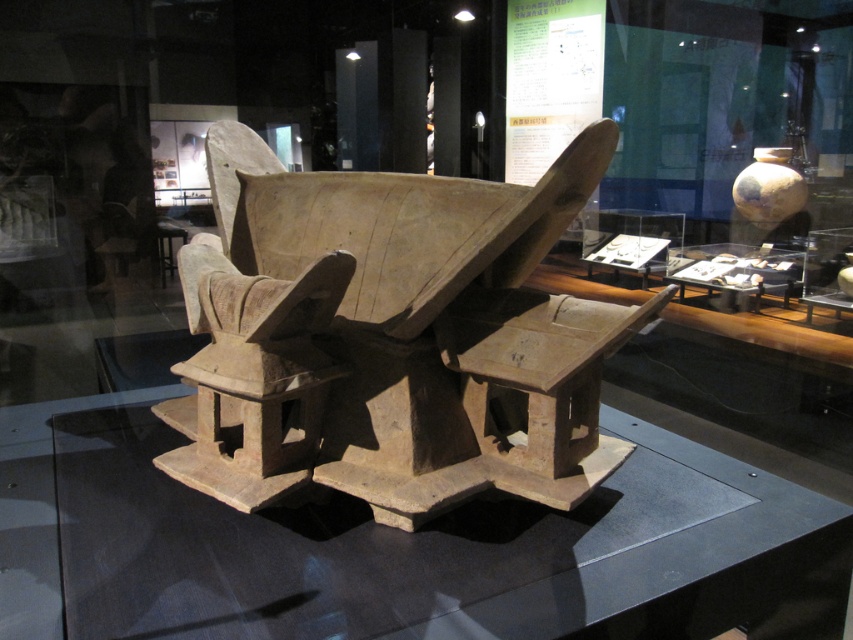
Question: From the image, what is the correct spatial relationship of brown clay structure at center in relation to transparent glass table at center?

Choices:
 (A) left
 (B) right

Answer: (B)

Question: Does brown clay structure at center come behind transparent glass table at center?

Choices:
 (A) yes
 (B) no

Answer: (A)

Question: Which object is farther from the camera taking this photo?

Choices:
 (A) brown clay structure at center
 (B) transparent glass table at center

Answer: (A)

Question: Which point appears farthest from the camera in this image?

Choices:
 (A) (225, 256)
 (B) (640, 554)

Answer: (A)

Question: Can you confirm if brown clay structure at center is positioned above transparent glass table at center?

Choices:
 (A) no
 (B) yes

Answer: (B)